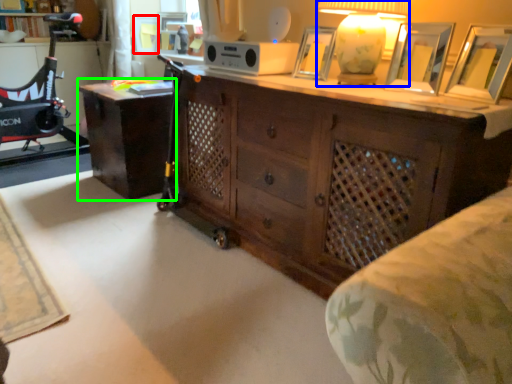
Question: Which is nearer to the picture frame (highlighted by a red box)? table lamp (highlighted by a blue box) or desk (highlighted by a green box).

Choices:
 (A) table lamp
 (B) desk

Answer: (B)